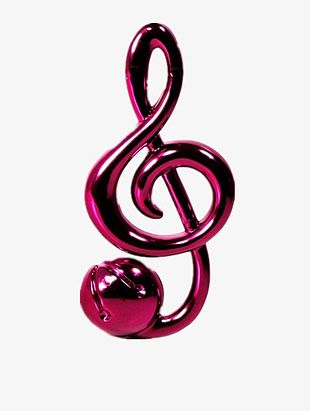
What are the coordinates of `curved rod` in the screenshot? It's located at point(163,330).